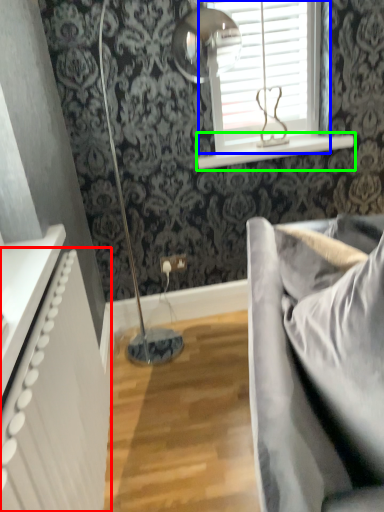
Question: Which object is the farthest from radiator (highlighted by a red box)? Choose among these: window (highlighted by a blue box) or window sill (highlighted by a green box).

Choices:
 (A) window
 (B) window sill

Answer: (A)